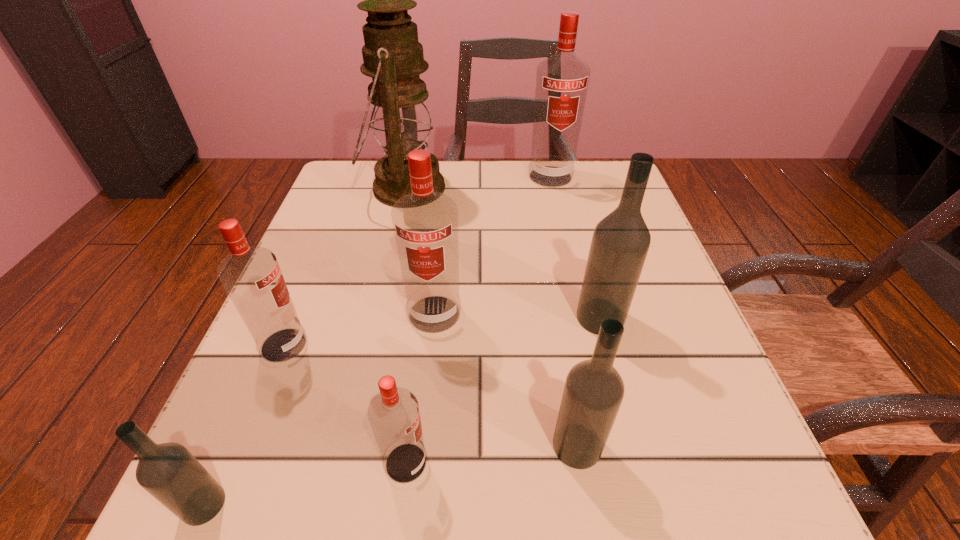
Image resolution: width=960 pixels, height=540 pixels. In order to click on vacant space at the far left corner in this screenshot , I will do pyautogui.click(x=343, y=161).

Where is `vacant space at the far right corner of the desktop`? vacant space at the far right corner of the desktop is located at coordinates click(591, 192).

At what (x,y) coordinates should I click in order to perform the action: click on unoccupied position between the biggest black vodka and the second biggest red vodka. Please return your answer as a coordinate pair (x, y). Looking at the image, I should click on (517, 316).

Image resolution: width=960 pixels, height=540 pixels. I want to click on unoccupied position between the farthest black vodka and the biggest red vodka, so click(575, 247).

You are a GUI agent. You are given a task and a screenshot of the screen. Output one action in this format:
    pyautogui.click(x=<x>, y=<y>)
    Task: Click on the free space between the leftmost black vodka and the farthest red vodka
    The image size is (960, 540).
    Given the screenshot: What is the action you would take?
    pyautogui.click(x=377, y=341)

At what (x,y) coordinates should I click in order to perform the action: click on vacant region between the green oil lamp and the tallest vodka. Please return your answer as a coordinate pair (x, y). The image size is (960, 540). Looking at the image, I should click on (478, 182).

Identify the location of unoccupied position between the nearest red vodka and the third smallest red vodka. (420, 388).

The width and height of the screenshot is (960, 540). What are the coordinates of `empty space between the oil lamp and the leftmost red vodka` in the screenshot? It's located at (345, 266).

Identify which object is the third nearest to the nearest black vodka. Please provide its 2D coordinates. Your answer should be formatted as a tuple, i.e. [(x, y)], where the tuple contains the x and y coordinates of a point satisfying the conditions above.

[(425, 223)]

Find the location of a particular element. object that is the fifth closest to the smallest black vodka is located at coordinates (620, 243).